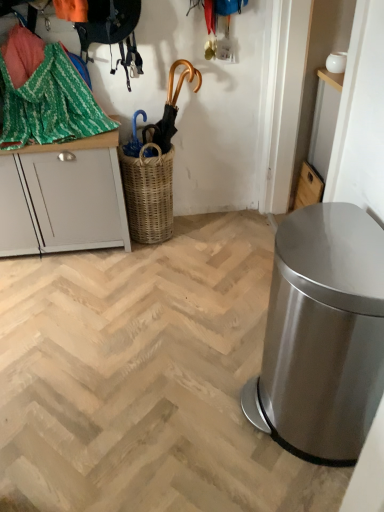
This screenshot has width=384, height=512. Find the location of `empty space that is ontop of white painted wood cabinet at left, marked as the 2th cabinetry in a right-to-left arrangement (from a real-world perspective)`. empty space that is ontop of white painted wood cabinet at left, marked as the 2th cabinetry in a right-to-left arrangement (from a real-world perspective) is located at coordinates (61, 135).